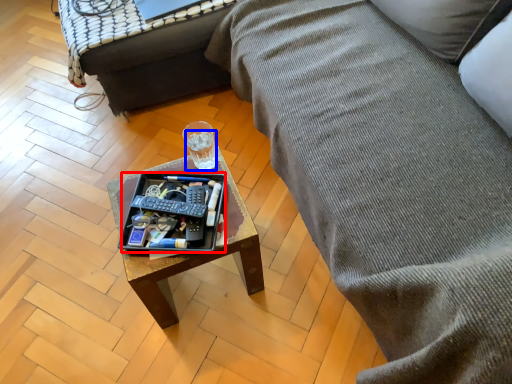
Question: Which object is further to the camera taking this photo, tray (highlighted by a red box) or beverage (highlighted by a blue box)?

Choices:
 (A) tray
 (B) beverage

Answer: (B)